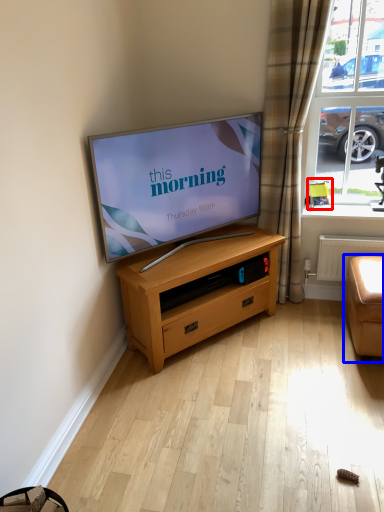
Question: Which object appears closest to the camera in this image, armchair (highlighted by a red box) or studio couch (highlighted by a blue box)?

Choices:
 (A) armchair
 (B) studio couch

Answer: (B)